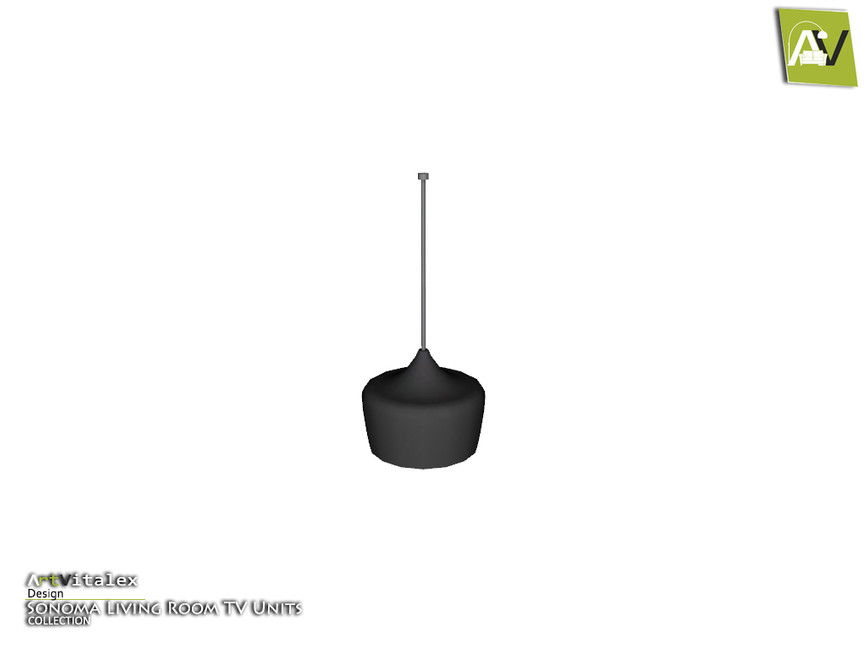
Locate an element on the screen. word "tv" is located at coordinates [x=232, y=608].